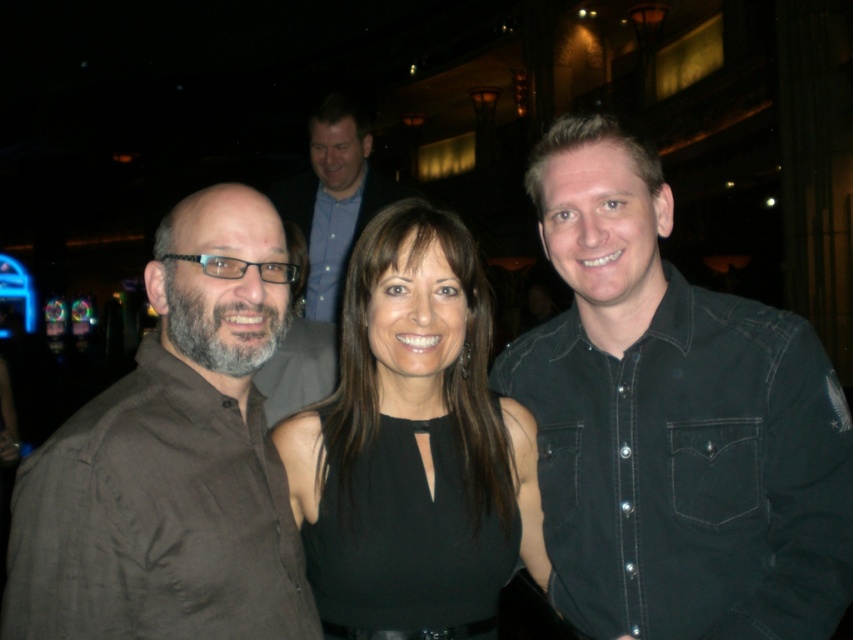
Who is lower down, brownmaterialshirt at left or blue button-down shirt at upper center?

brownmaterialshirt at left is below.

Does brownmaterialshirt at left have a lesser width compared to blue button-down shirt at upper center?

Yes, brownmaterialshirt at left is thinner than blue button-down shirt at upper center.

Is point (164, 513) positioned behind point (329, 186)?

No, (164, 513) is closer to viewer.

Where is `brownmaterialshirt at left`? brownmaterialshirt at left is located at coordinates (172, 460).

From the picture: Which of these two, brownmaterialshirt at left or black matte dress at center, stands taller?

black matte dress at center

Looking at this image, does brownmaterialshirt at left have a smaller size compared to black matte dress at center?

No, brownmaterialshirt at left is not smaller than black matte dress at center.

Does point (274, 291) come farther from viewer compared to point (351, 353)?

No, it is not.

Locate an element on the screen. Image resolution: width=853 pixels, height=640 pixels. brownmaterialshirt at left is located at coordinates (172, 460).

Is point (614, 481) positioned before point (263, 509)?

No, it is not.

At what (x,y) coordinates should I click in order to perform the action: click on black denim shirt at center. Please return your answer as a coordinate pair (x, y). Looking at the image, I should click on (672, 422).